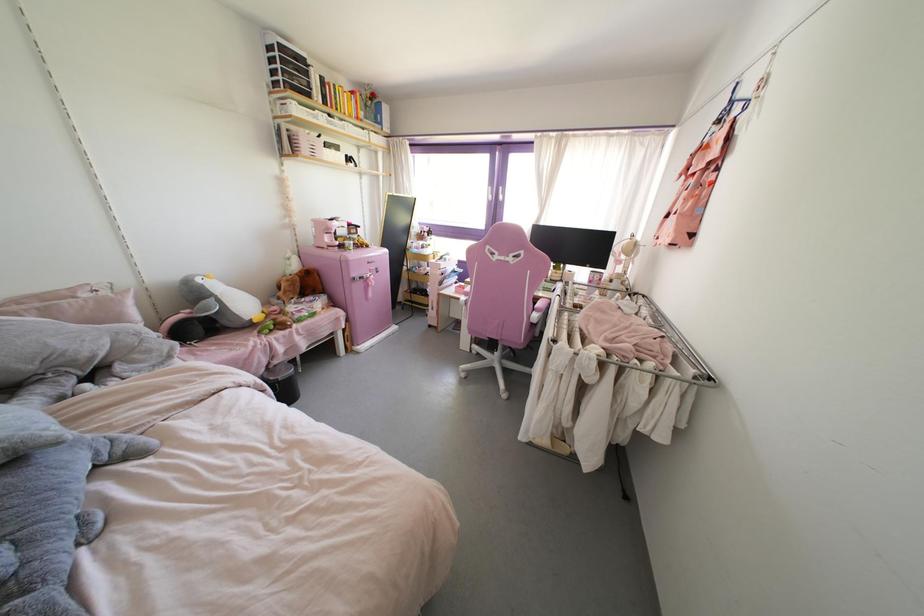
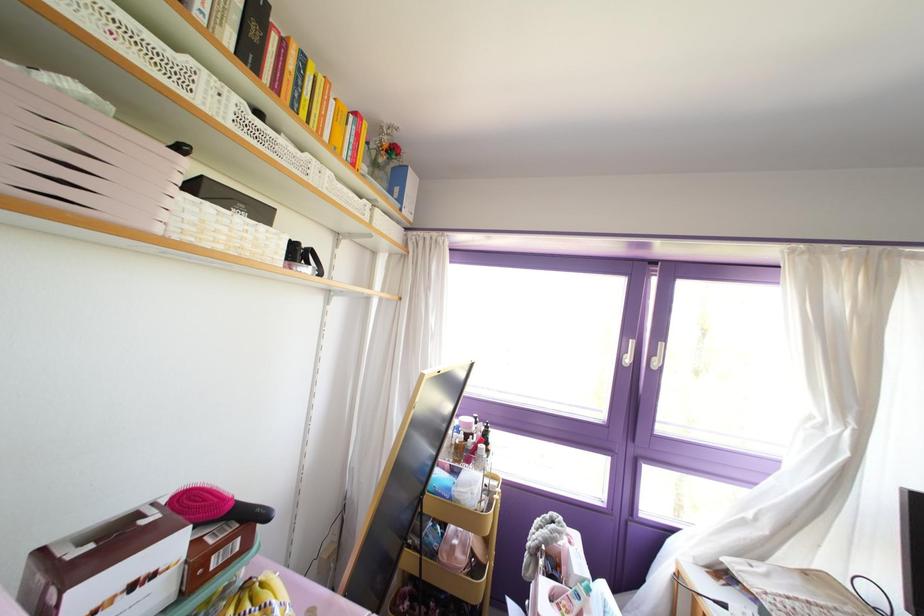
In the second image, find the point that corresponds to (x=357, y=118) in the first image.

(351, 164)